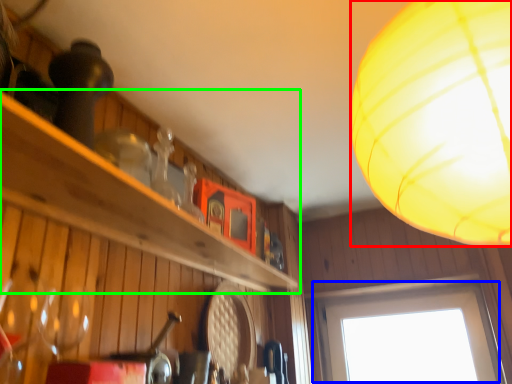
Question: Which object is the farthest from lamp (highlighted by a red box)? Choose among these: window (highlighted by a blue box) or shelf (highlighted by a green box).

Choices:
 (A) window
 (B) shelf

Answer: (A)